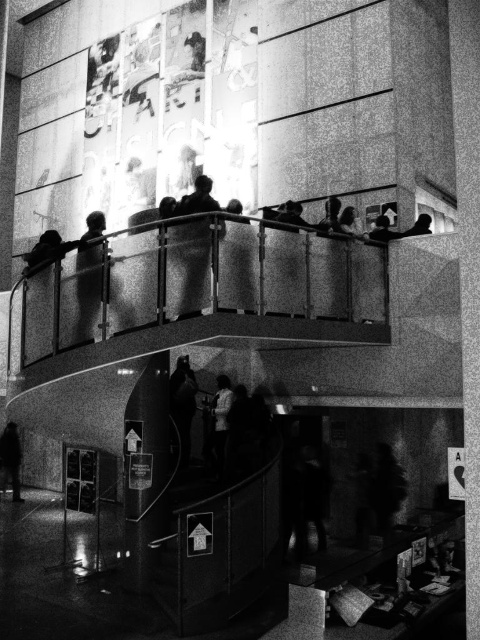
You are an artist trying to decide which jacket to wear for your gallery opening. You need to choose between the smooth black jacket at upper left and the white fabric jacket at center. Based on their thickness, which jacket would be easier to pack in a small suitcase?

The smooth black jacket at upper left is thinner than the white fabric jacket at center, so it would be easier to pack in a small suitcase.

You are standing in the gallery and want to locate the smooth black jacket at upper left. According to the coordinates provided, where exactly is it positioned in the image?

The smooth black jacket at upper left is positioned at the 2D coordinates point (87, 301) in the image.